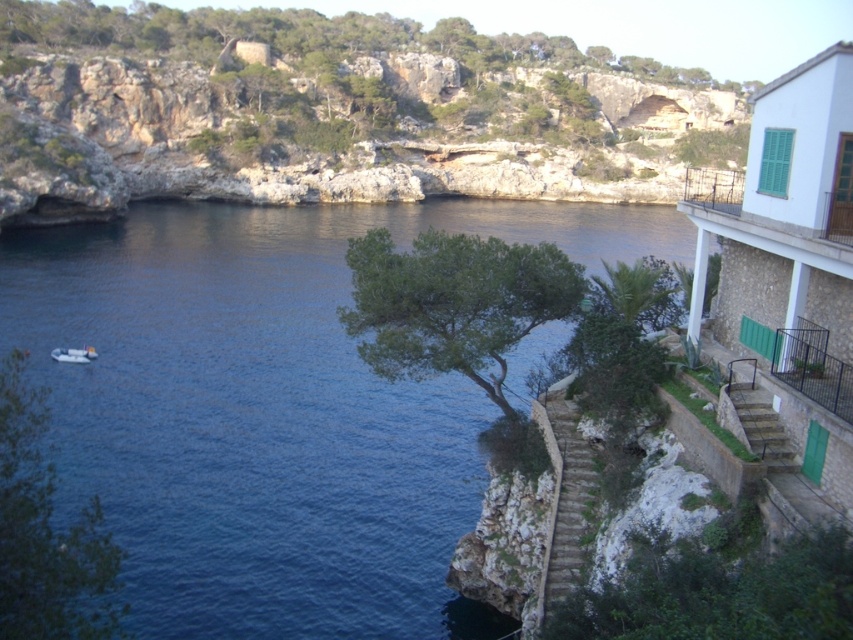
What do you see at coordinates (453, 301) in the screenshot? This screenshot has height=640, width=853. I see `green leafy tree at center` at bounding box center [453, 301].

Who is positioned more to the right, green leafy tree at center or green leafy palm at center?

Positioned to the right is green leafy palm at center.

Image resolution: width=853 pixels, height=640 pixels. Find the location of `green leafy tree at center`. green leafy tree at center is located at coordinates (453, 301).

Is point (193, 365) farther from viewer compared to point (350, 241)?

That is True.

Between point (155, 435) and point (451, 307), which one is positioned in front?

Point (451, 307)

Identify the location of blue water at center. Image resolution: width=853 pixels, height=640 pixels. (270, 410).

Is blue water at center positioned at the back of green leafy palm at center?

No, blue water at center is closer to the viewer.

Is point (206, 202) farther from viewer compared to point (634, 304)?

Yes, point (206, 202) is behind point (634, 304).

Find the location of `blue water at center`. blue water at center is located at coordinates (270, 410).